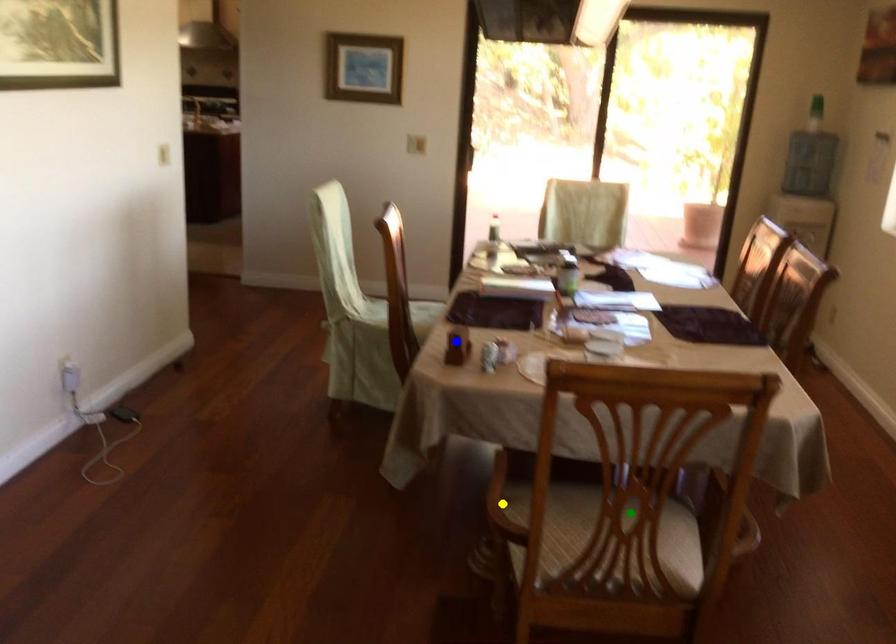
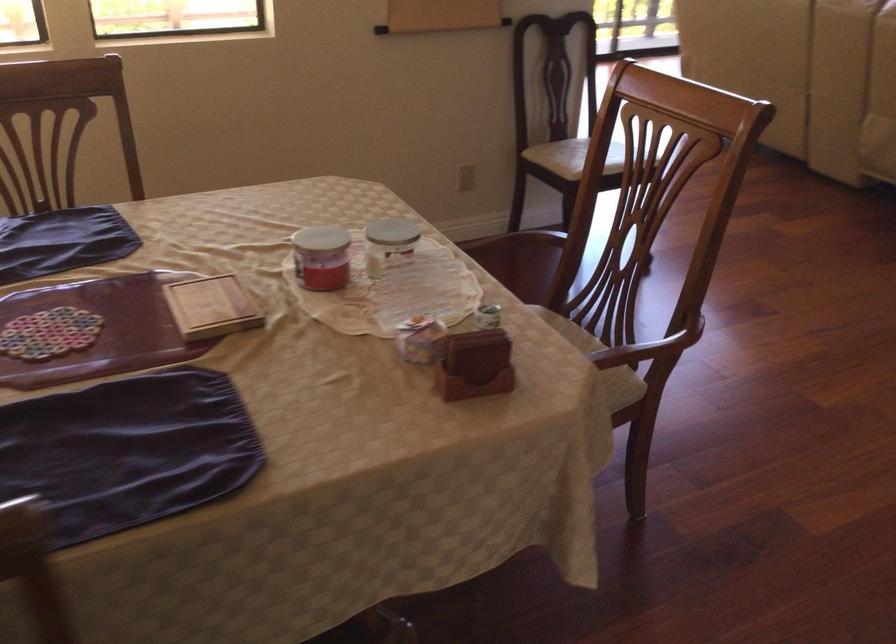
I am providing you with two images of the same scene from different viewpoints. Three points are marked in image1. Which point corresponds to a part or object that is occluded in image2?In image1, three points are marked. Which of them correspond to a part or object that is occluded in image2?Among the three points shown in image1, which one corresponds to a part or object that is no longer visible due to occlusion in image2?

yellow point, green point cannot be seen in image2.